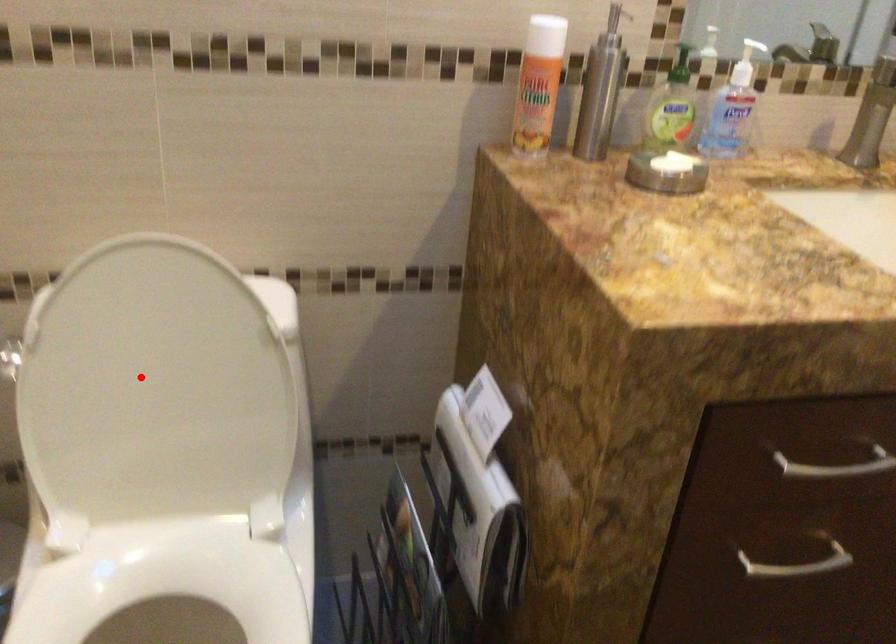
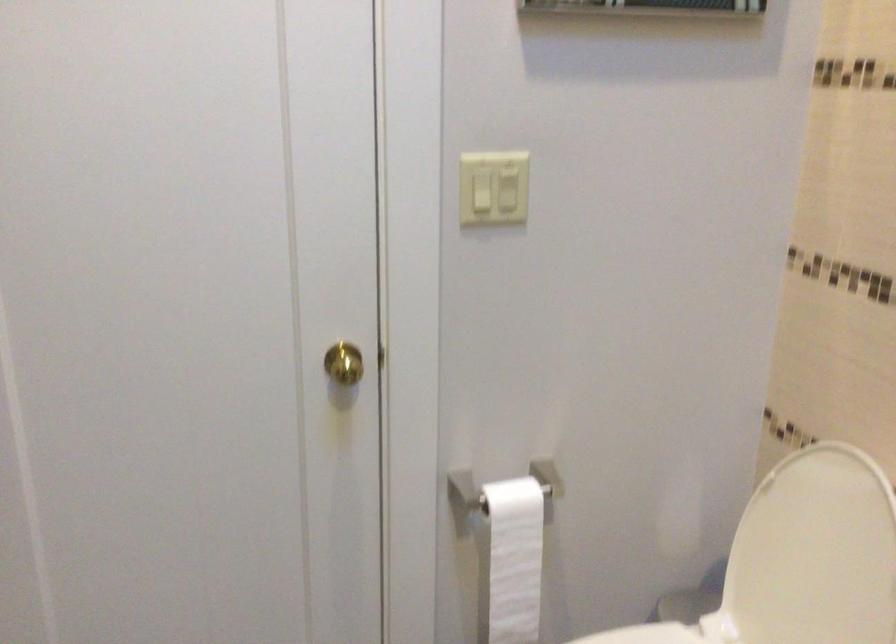
Question: I am providing you with two images of the same scene from different viewpoints. A red point is shown in image1. For the corresponding object point in image2, is it positioned nearer or farther from the camera?

Choices:
 (A) Nearer
 (B) Farther

Answer: (B)